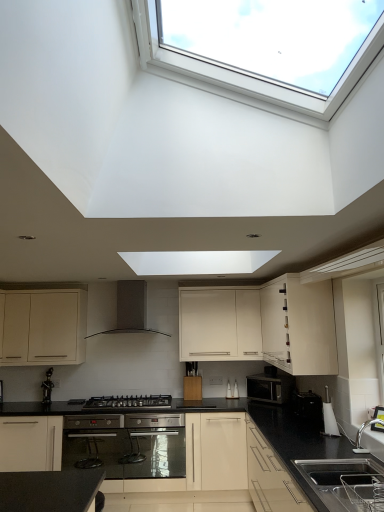
Question: Does white plastic kettle at lower right, acting as the first appliance starting from the front, lie in front of black matte gas stove at center?

Choices:
 (A) yes
 (B) no

Answer: (A)

Question: Would you say white plastic kettle at lower right, the third appliance viewed from the back, is outside black matte gas stove at center?

Choices:
 (A) yes
 (B) no

Answer: (A)

Question: Can you confirm if white plastic kettle at lower right, the third appliance viewed from the back, is shorter than black matte gas stove at center?

Choices:
 (A) yes
 (B) no

Answer: (B)

Question: From a real-world perspective, is white plastic kettle at lower right, acting as the first appliance starting from the front, beneath black matte gas stove at center?

Choices:
 (A) yes
 (B) no

Answer: (B)

Question: Considering the relative sizes of white plastic kettle at lower right, the third appliance viewed from the back, and black matte gas stove at center in the image provided, is white plastic kettle at lower right, the third appliance viewed from the back, wider than black matte gas stove at center?

Choices:
 (A) no
 (B) yes

Answer: (A)

Question: Considering their positions, is white glossy cabinet at upper right, positioned as the first cabinetry in right-to-left order, located in front of or behind black matte range hood at center?

Choices:
 (A) front
 (B) behind

Answer: (A)

Question: From a real-world perspective, is white glossy cabinet at upper right, positioned as the first cabinetry in right-to-left order, physically located above or below black matte range hood at center?

Choices:
 (A) below
 (B) above

Answer: (A)

Question: From the image's perspective, is white glossy cabinet at upper right, acting as the third cabinetry starting from the left, located above or below black matte range hood at center?

Choices:
 (A) below
 (B) above

Answer: (A)

Question: Based on their positions, is white glossy cabinet at upper right, acting as the third cabinetry starting from the left, located to the left or right of black matte range hood at center?

Choices:
 (A) right
 (B) left

Answer: (A)

Question: Relative to black granite sink at lower right, is black matte gas stove at center in front or behind?

Choices:
 (A) behind
 (B) front

Answer: (A)

Question: Is black matte gas stove at center inside or outside of black granite sink at lower right?

Choices:
 (A) outside
 (B) inside

Answer: (A)

Question: From their relative heights in the image, would you say black matte gas stove at center is taller or shorter than black granite sink at lower right?

Choices:
 (A) tall
 (B) short

Answer: (B)

Question: Is black matte gas stove at center to the left or to the right of black granite sink at lower right in the image?

Choices:
 (A) right
 (B) left

Answer: (B)

Question: From a real-world perspective, is black plastic toaster at lower right, which is counted as the second appliance, starting from the back, above or below matte black microwave at center, the first appliance in the back-to-front sequence?

Choices:
 (A) below
 (B) above

Answer: (A)

Question: From their relative heights in the image, would you say black plastic toaster at lower right, which is counted as the second appliance, starting from the back, is taller or shorter than matte black microwave at center, the first appliance in the back-to-front sequence?

Choices:
 (A) short
 (B) tall

Answer: (A)